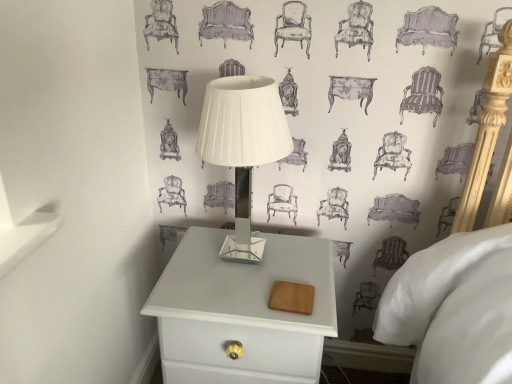
The height and width of the screenshot is (384, 512). What are the coordinates of `vacant region in front of white glossy table lamp at center` in the screenshot? It's located at (244, 298).